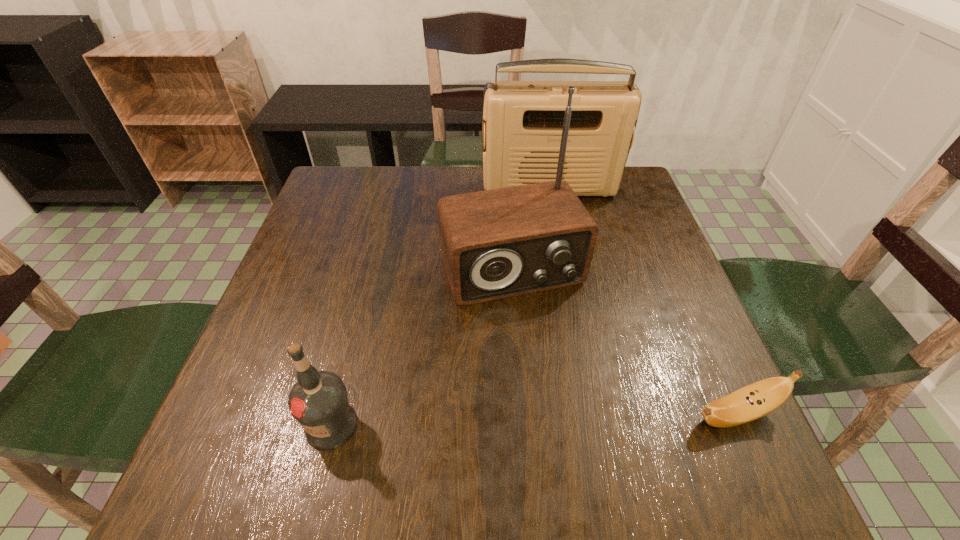
The height and width of the screenshot is (540, 960). In order to click on object located at the near right corner in this screenshot , I will do `click(758, 399)`.

I want to click on free space at the far edge of the desktop, so click(418, 201).

This screenshot has width=960, height=540. Find the location of `free space at the near edge`. free space at the near edge is located at coordinates (486, 436).

I want to click on free region at the left edge, so click(308, 247).

In the image, there is a desktop. Identify the location of vacant area at the right edge. This screenshot has height=540, width=960. (631, 314).

Identify the location of free location at the far left corner. (378, 172).

At what (x,y) coordinates should I click in order to perform the action: click on free space between the shortest object and the farther radio receiver. Please return your answer as a coordinate pair (x, y). This screenshot has height=540, width=960. Looking at the image, I should click on (642, 301).

Image resolution: width=960 pixels, height=540 pixels. In order to click on free spot between the farther radio receiver and the banana in this screenshot , I will do `click(642, 301)`.

Find the location of `empty space between the leftmost object and the third nearest object`. empty space between the leftmost object and the third nearest object is located at coordinates (421, 347).

The image size is (960, 540). I want to click on vacant region between the banana and the leftmost object, so click(x=534, y=420).